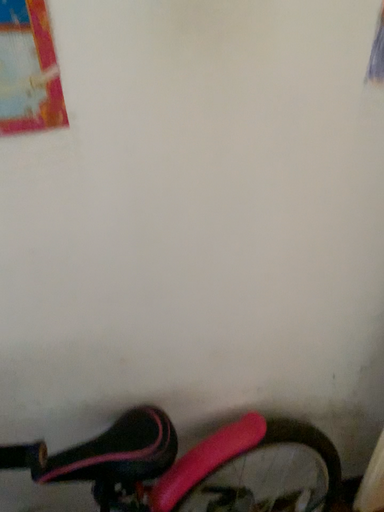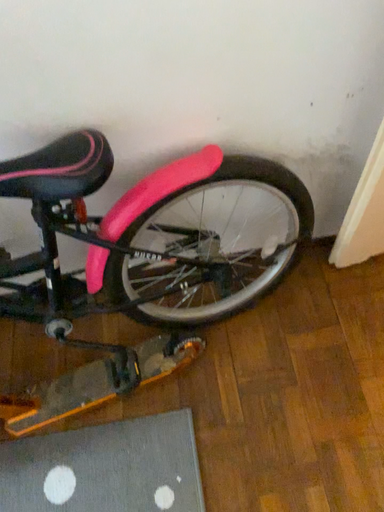
Question: Which way did the camera rotate in the video?

Choices:
 (A) rotated downward
 (B) rotated upward

Answer: (A)